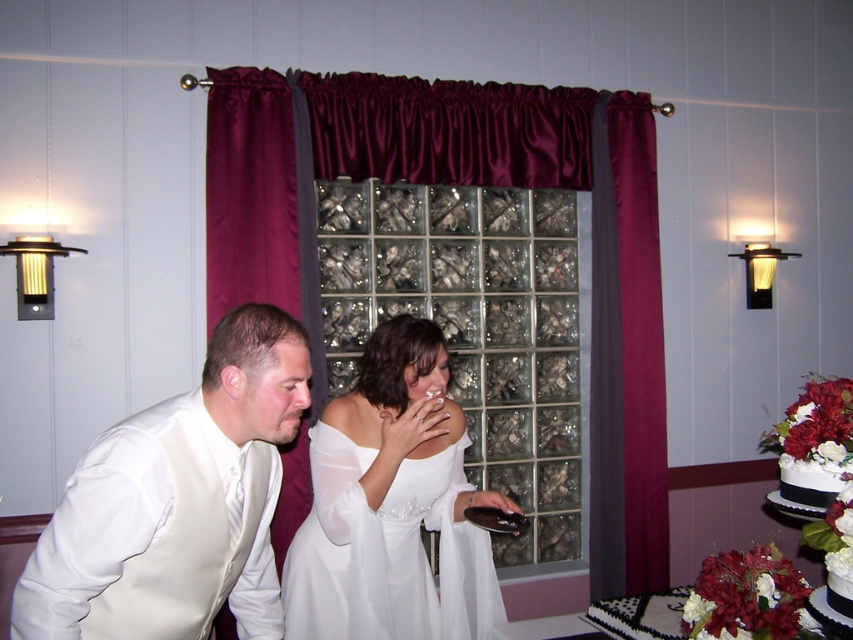
Question: Is maroon satin curtain at center wider than white satin vest at left?

Choices:
 (A) yes
 (B) no

Answer: (A)

Question: Estimate the real-world distances between objects in this image. Which object is closer to the white satin dress at center?

Choices:
 (A) maroon satin curtain at center
 (B) white satin vest at left

Answer: (B)

Question: Which point is closer to the camera?

Choices:
 (A) (228, 164)
 (B) (102, 449)
 (C) (397, 499)

Answer: (B)

Question: Does white satin vest at left have a greater width compared to white satin dress at center?

Choices:
 (A) no
 (B) yes

Answer: (A)

Question: Is white satin vest at left thinner than white satin dress at center?

Choices:
 (A) no
 (B) yes

Answer: (B)

Question: Among these points, which one is nearest to the camera?

Choices:
 (A) (396, 422)
 (B) (157, 621)
 (C) (224, 266)

Answer: (B)